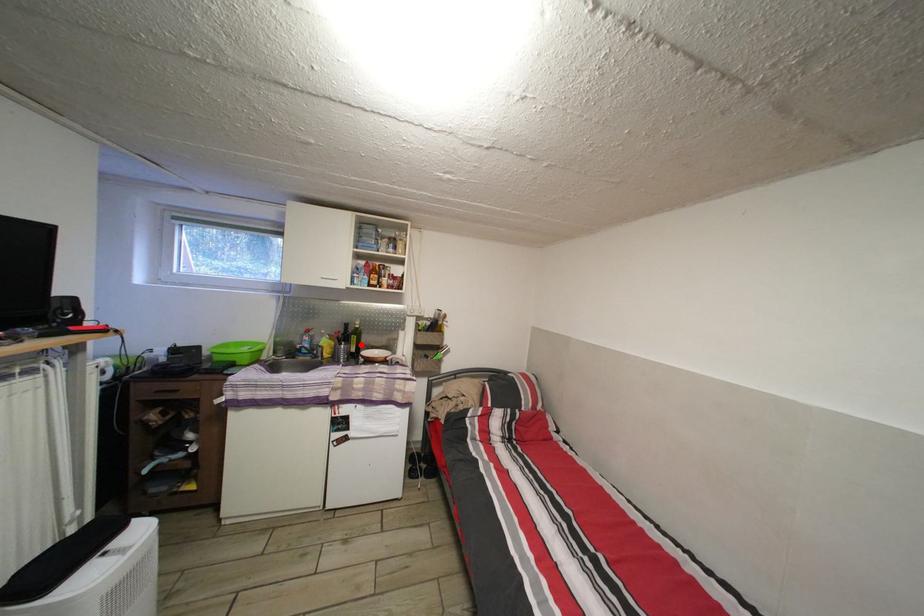
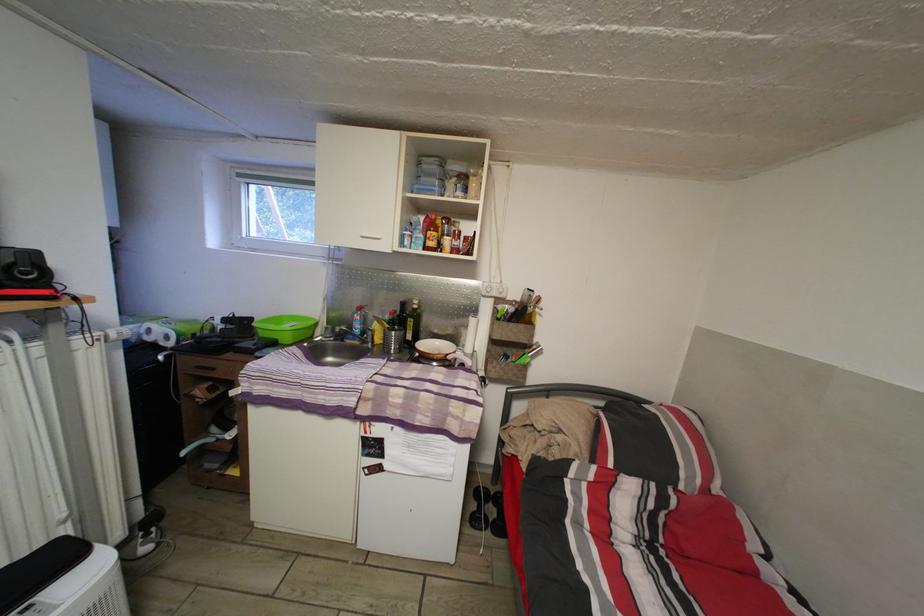
Question: I am providing you with two images of the same scene from different viewpoints. A red point is shown in image1. For the corresponding object point in image2, is it positioned nearer or farther from the camera?

Choices:
 (A) Nearer
 (B) Farther

Answer: (A)